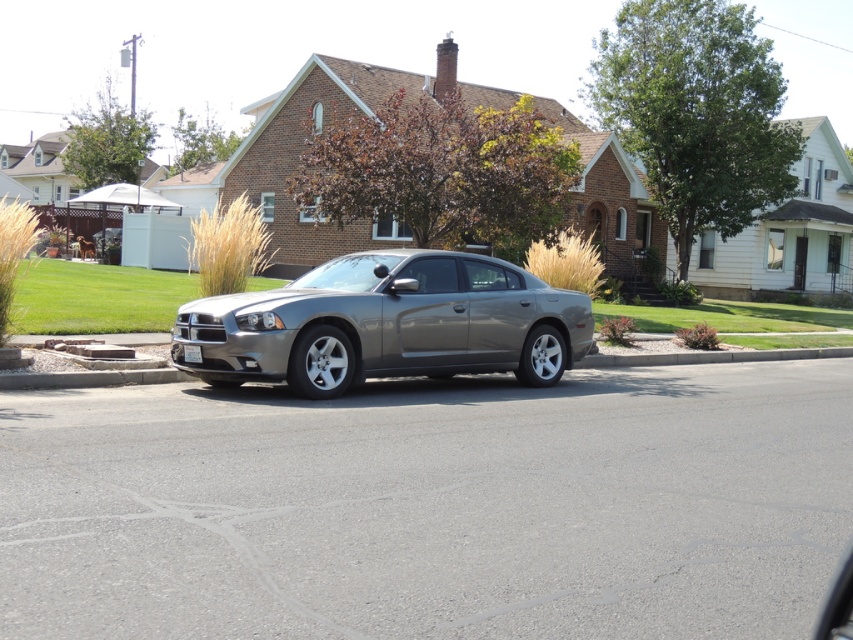
Question: In this image, where is gray asphalt driveway at center located relative to satin metallic sedan at center?

Choices:
 (A) below
 (B) above

Answer: (A)

Question: Does satin metallic sedan at center have a greater width compared to white plastic license plate at center?

Choices:
 (A) yes
 (B) no

Answer: (A)

Question: Is gray asphalt driveway at center thinner than satin metallic sedan at center?

Choices:
 (A) yes
 (B) no

Answer: (B)

Question: Which object is closer to the camera taking this photo?

Choices:
 (A) gray asphalt driveway at center
 (B) white plastic license plate at center
 (C) satin metallic sedan at center

Answer: (A)

Question: Among these objects, which one is farthest from the camera?

Choices:
 (A) satin metallic sedan at center
 (B) white plastic license plate at center
 (C) gray asphalt driveway at center

Answer: (B)

Question: Which point is closer to the camera?

Choices:
 (A) satin metallic sedan at center
 (B) white plastic license plate at center
 (C) gray asphalt driveway at center

Answer: (C)